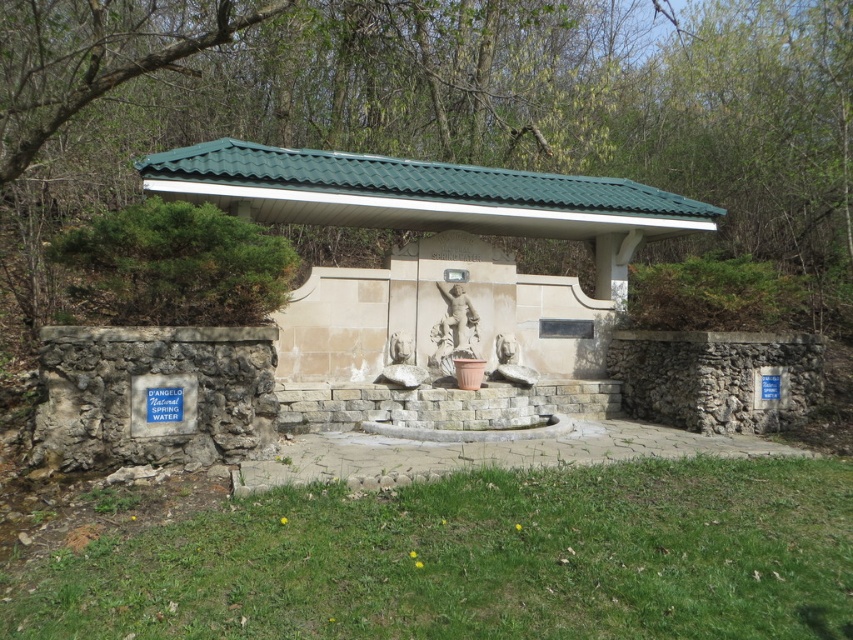
Looking at this image, you are standing in the outdoor area looking at the scene. There is a green leafy tree at upper center and a white stone fountain at center. Which object is positioned more to the right side of the scene?

The green leafy tree at upper center is positioned more to the right side of the scene compared to the white stone fountain at center.

You are standing in the outdoor area and want to know which object is taller between the green leafy tree at upper center and the white stone fountain at center. Can you tell me which one is taller?

The green leafy tree at upper center is much taller than the white stone fountain at center according to the description.